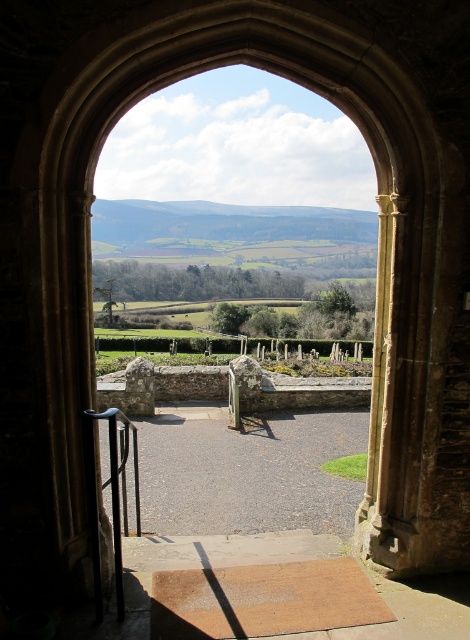
Question: Does gray gravel path at center come in front of black metal rail at lower left?

Choices:
 (A) no
 (B) yes

Answer: (A)

Question: Does gray gravel path at center have a larger size compared to black metal rail at lower left?

Choices:
 (A) yes
 (B) no

Answer: (B)

Question: Considering the relative positions of gray gravel path at center and black metal rail at lower left in the image provided, where is gray gravel path at center located with respect to black metal rail at lower left?

Choices:
 (A) above
 (B) below

Answer: (B)

Question: Among these points, which one is farthest from the camera?

Choices:
 (A) click(x=114, y=490)
 (B) click(x=149, y=426)

Answer: (B)

Question: Which point appears farthest from the camera in this image?

Choices:
 (A) (x=117, y=508)
 (B) (x=283, y=515)

Answer: (B)

Question: Which point is farther from the camera taking this photo?

Choices:
 (A) [x=235, y=451]
 (B) [x=98, y=500]

Answer: (A)